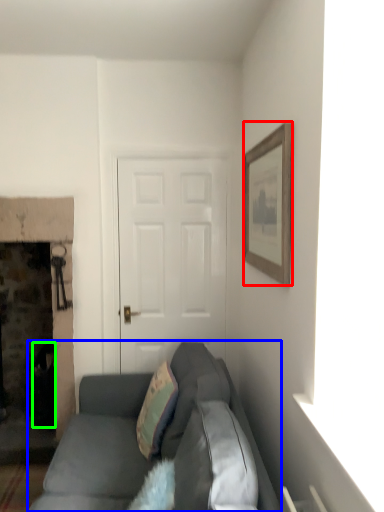
Question: Considering the real-world distances, which object is closest to picture frame (highlighted by a red box)? studio couch (highlighted by a blue box) or trash bin/can (highlighted by a green box).

Choices:
 (A) studio couch
 (B) trash bin/can

Answer: (A)